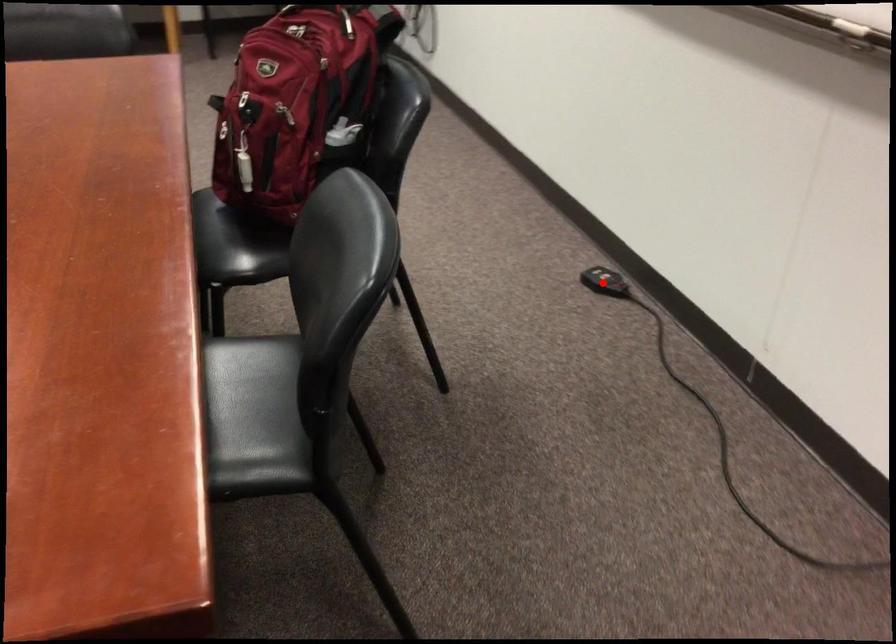
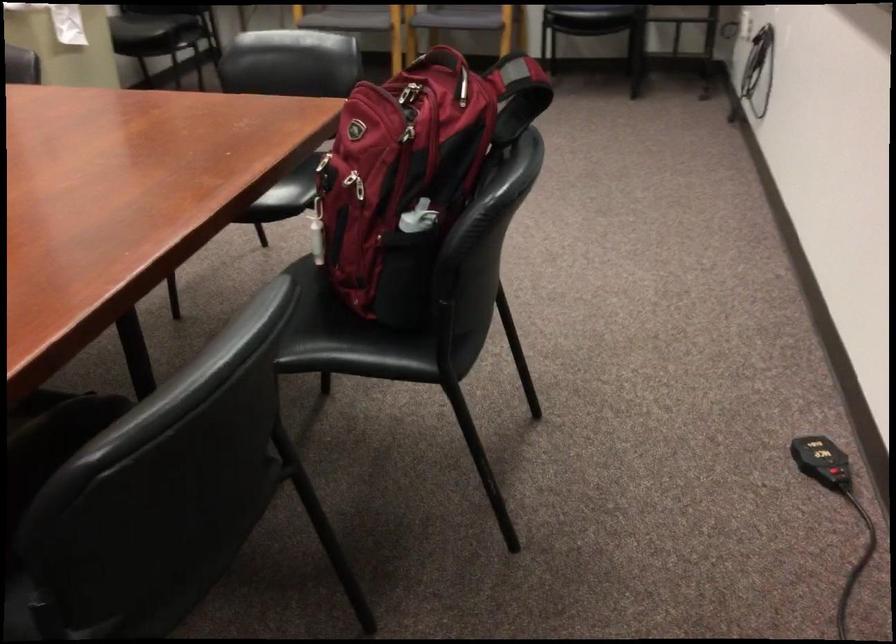
The point at the highlighted location is marked in the first image. Where is the corresponding point in the second image?

(822, 460)